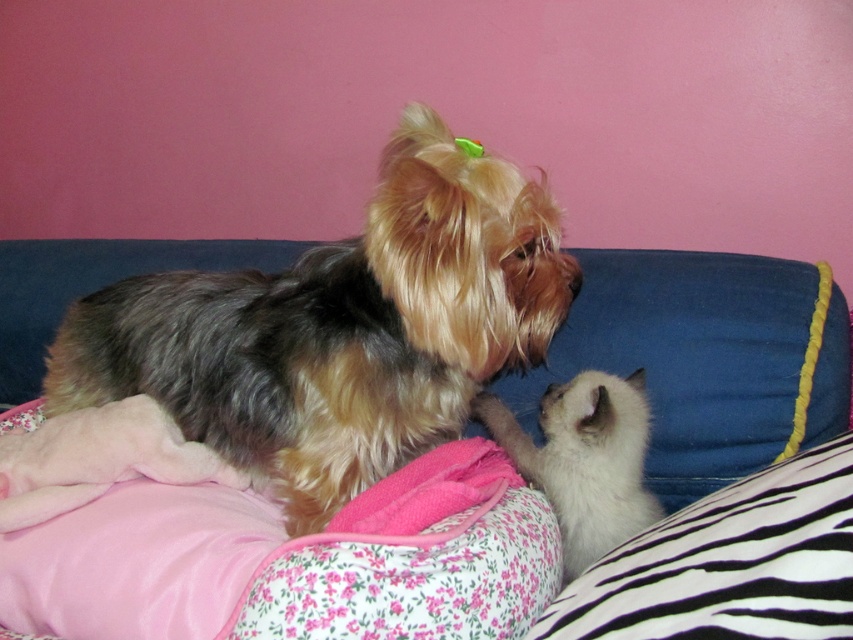
You are holding a camera that can capture objects up to 36 inches away. You want to take a photo of the shaggy brown dog at center. Based on the scene description, will the dog be in focus?

Answer: The shaggy brown dog at center is 37.19 inches away from the camera, which is beyond the camera maximum focus range of 36 inches. Therefore, the dog will not be in focus.

You are standing in front of the couch where the dog and kitten are playing. There are two points marked on the couch. Which of the two points, point (230, 417) or point (538, 420), is closer to you?

Point (230, 417) is closer to the viewer than point (538, 420).

You are a photographer setting up a shoot in the scene. You want to capture the shaggy brown dog at center and the blue fabric couch at center in a single shot. Based on their positions, which object will appear closer to the camera in the photo?

The shaggy brown dog at center is in front of the blue fabric couch at center, so it will appear closer to the camera in the photo.